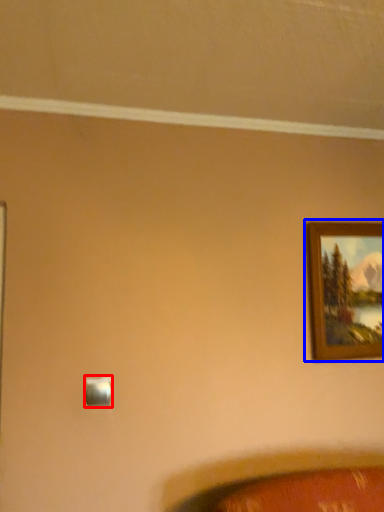
Question: Among these objects, which one is farthest to the camera, light switch (highlighted by a red box) or picture frame (highlighted by a blue box)?

Choices:
 (A) light switch
 (B) picture frame

Answer: (B)